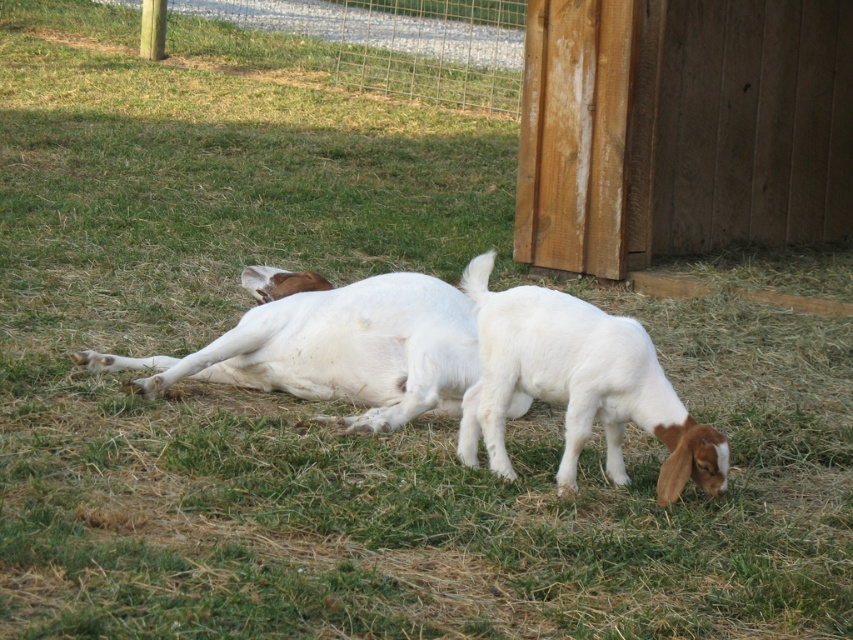
Question: Which of the following is the closest to the observer?

Choices:
 (A) (354, 289)
 (B) (473, 452)
 (C) (390, 17)

Answer: (B)

Question: Which point is farther to the camera?

Choices:
 (A) click(x=457, y=38)
 (B) click(x=412, y=275)
 (C) click(x=590, y=348)

Answer: (A)

Question: Which object is closer to the camera taking this photo?

Choices:
 (A) white fluffy goat at lower right
 (B) white soft fur goat at center

Answer: (A)

Question: Is wire mesh fence at upper center below white fluffy goat at lower right?

Choices:
 (A) no
 (B) yes

Answer: (A)

Question: Considering the relative positions of wire mesh fence at upper center and white soft fur goat at center in the image provided, where is wire mesh fence at upper center located with respect to white soft fur goat at center?

Choices:
 (A) right
 (B) left

Answer: (B)

Question: Can you confirm if wire mesh fence at upper center is positioned to the left of white fluffy goat at lower right?

Choices:
 (A) no
 (B) yes

Answer: (B)